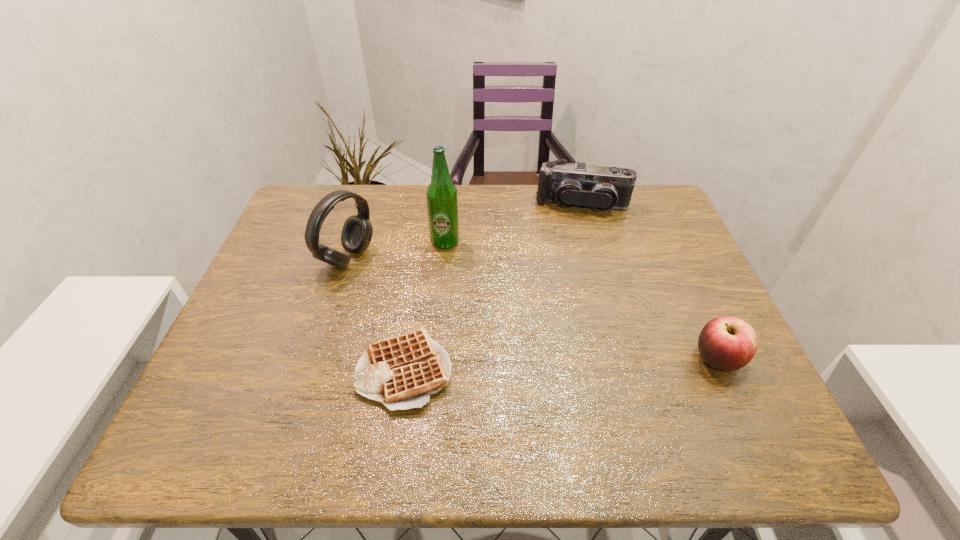
The image size is (960, 540). What are the coordinates of `vacant area between the camcorder and the tallest object` in the screenshot? It's located at (513, 223).

Where is `vacant space that is in between the fourth tallest object and the beer bottle`? This screenshot has height=540, width=960. vacant space that is in between the fourth tallest object and the beer bottle is located at coordinates (581, 301).

This screenshot has width=960, height=540. I want to click on object that stands as the second closest to the shortest object, so click(x=442, y=200).

Identify the location of object identified as the third closest to the second object from right to left. This screenshot has height=540, width=960. (357, 231).

Locate an element on the screen. The image size is (960, 540). blank area in the image that satisfies the following two spatial constraints: 1. on the front side of the beer bottle; 2. on the bitten side of the fourth tallest object is located at coordinates (435, 359).

The width and height of the screenshot is (960, 540). In order to click on free space that satisfies the following two spatial constraints: 1. on the back side of the waffle; 2. on the right side of the beer bottle in this screenshot , I will do `click(422, 242)`.

Where is `free space that satisfies the following two spatial constraints: 1. on the front side of the tallest object; 2. on the bitten side of the apple`? The width and height of the screenshot is (960, 540). free space that satisfies the following two spatial constraints: 1. on the front side of the tallest object; 2. on the bitten side of the apple is located at coordinates (435, 359).